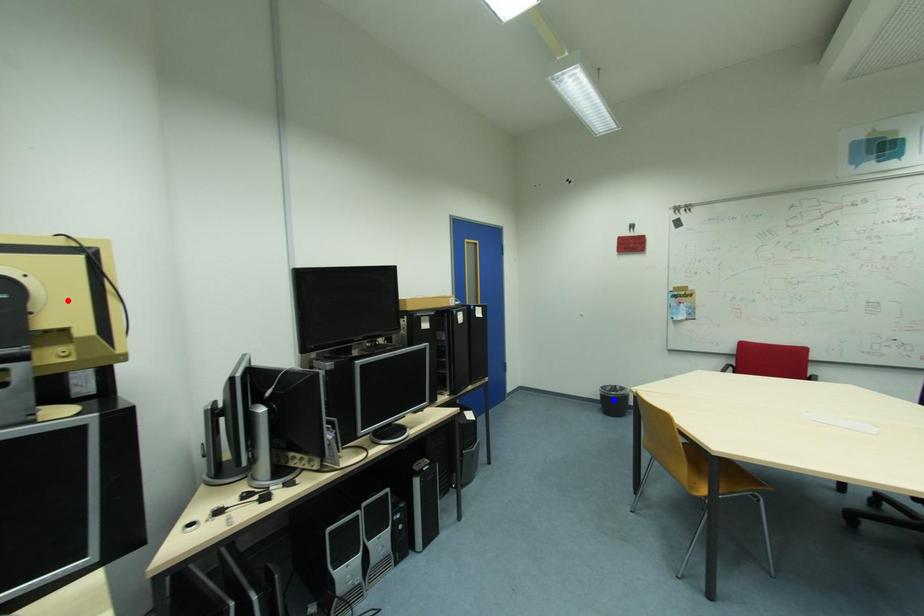
Question: Which of the two points in the image is closer to the camera?

Choices:
 (A) Blue point is closer.
 (B) Red point is closer.

Answer: (B)